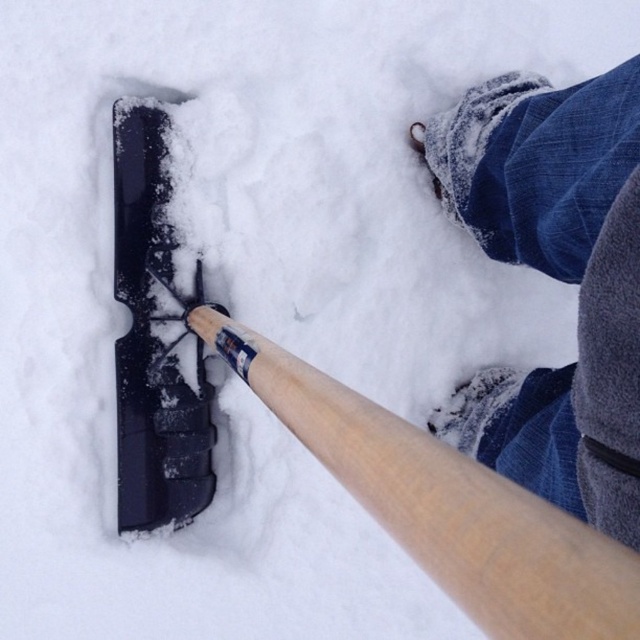
You are trying to decide where to place a new snowman accessory. The wooden baseball bat at lower left and the blue denim jeans at lower right are in the scene. Which object is located above the other?

The wooden baseball bat at lower left is positioned over blue denim jeans at lower right.

From the picture: You are standing at the origin point of the image. You want to move to the wooden baseball bat at lower left. Which direction should you move in to reach it?

The wooden baseball bat at lower left is located at point 0.789 in the x coordinate and 0.697 in the y coordinate. Since you are at the origin point, you should move towards the positive x and positive y direction to reach it.